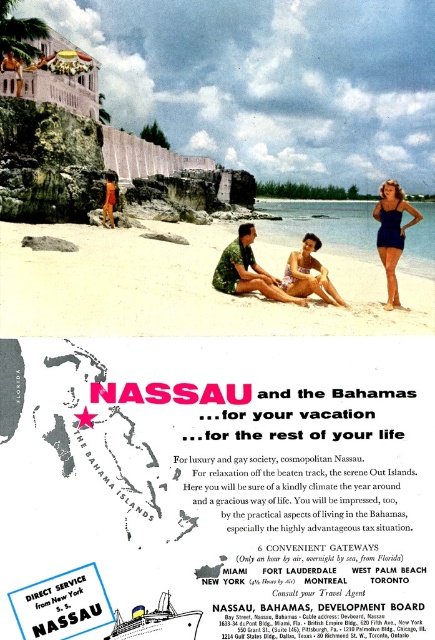
Between white sandy beach at center and orange swimsuit at center, which one appears on the left side from the viewer's perspective?

orange swimsuit at center

Who is more forward, [184,326] or [110,188]?

Point [184,326]

Find the location of a particular element. The width and height of the screenshot is (435, 640). white sandy beach at center is located at coordinates (177, 289).

Looking at this image, which is below, white glossy ship at lower center or beige fabric bikini at center?

white glossy ship at lower center is lower down.

Can you confirm if white glossy ship at lower center is bigger than beige fabric bikini at center?

No.

Between point (137, 614) and point (303, 248), which one is positioned behind?

The point (303, 248) is behind.

Locate an element on the screen. Image resolution: width=435 pixels, height=640 pixels. white glossy ship at lower center is located at coordinates (157, 621).

Is point (256, 268) closer to camera compared to point (103, 218)?

That is True.

Can you confirm if matte green shirt at center is positioned above orange swimsuit at center?

Actually, matte green shirt at center is below orange swimsuit at center.

Is point (238, 284) in front of point (107, 198)?

Yes.

Where is `matte green shirt at center`? The image size is (435, 640). matte green shirt at center is located at coordinates (247, 269).